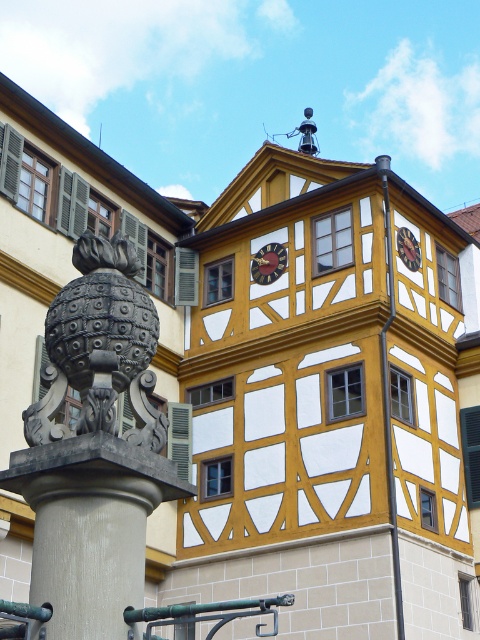
Question: Can you confirm if smooth gray stone column at lower left is thinner than dark gray stone sphere at left?

Choices:
 (A) no
 (B) yes

Answer: (B)

Question: Which point appears farthest from the camera in this image?

Choices:
 (A) (156, 468)
 (B) (123, 316)

Answer: (B)

Question: Can you confirm if smooth gray stone column at lower left is bigger than dark gray stone sphere at left?

Choices:
 (A) yes
 (B) no

Answer: (B)

Question: From the image, what is the correct spatial relationship of smooth gray stone column at lower left in relation to dark gray stone sphere at left?

Choices:
 (A) above
 (B) below

Answer: (B)

Question: Among these points, which one is farthest from the camera?

Choices:
 (A) (85, 500)
 (B) (261, 268)

Answer: (B)

Question: Among these points, which one is farthest from the camera?

Choices:
 (A) (268, 282)
 (B) (96, 353)

Answer: (A)